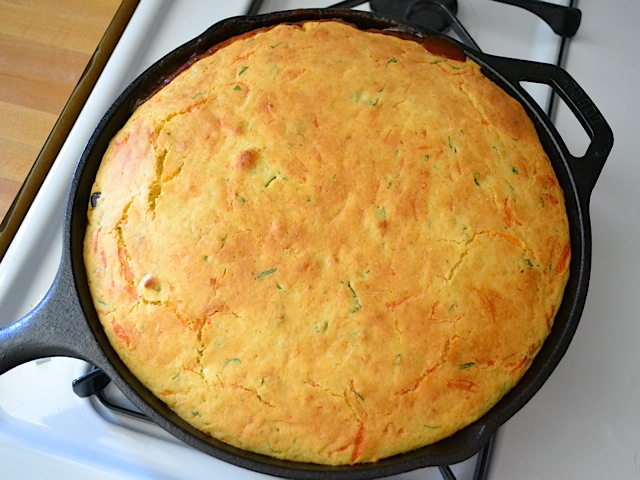
The width and height of the screenshot is (640, 480). I want to click on black cast iron pan, so click(58, 323).